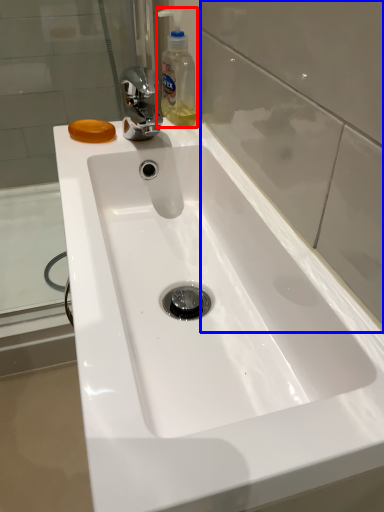
Question: Among these objects, which one is farthest to the camera, cleaning product (highlighted by a red box) or glass door (highlighted by a blue box)?

Choices:
 (A) cleaning product
 (B) glass door

Answer: (A)